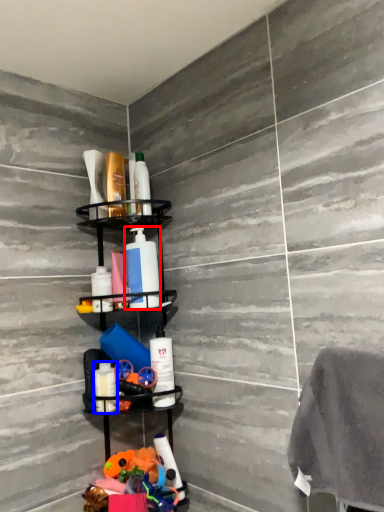
Question: Which object appears farthest to the camera in this image, cleaning product (highlighted by a red box) or toiletry (highlighted by a blue box)?

Choices:
 (A) cleaning product
 (B) toiletry

Answer: (A)